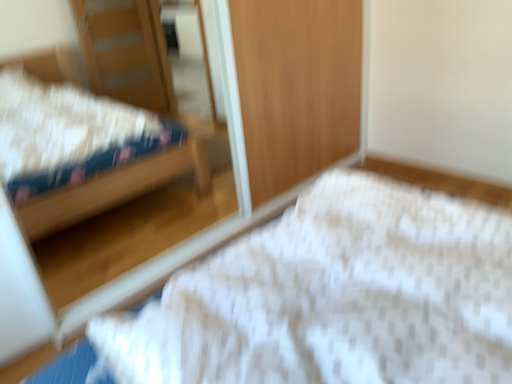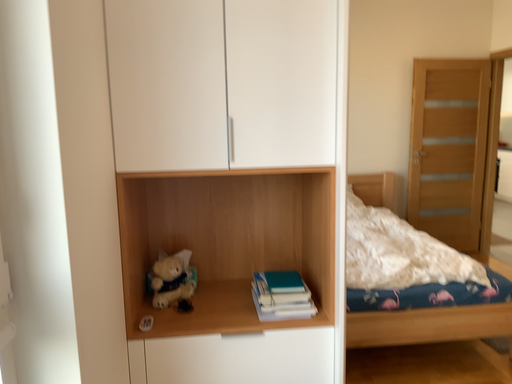
Question: How did the camera likely rotate when shooting the video?

Choices:
 (A) rotated upward
 (B) rotated downward

Answer: (A)